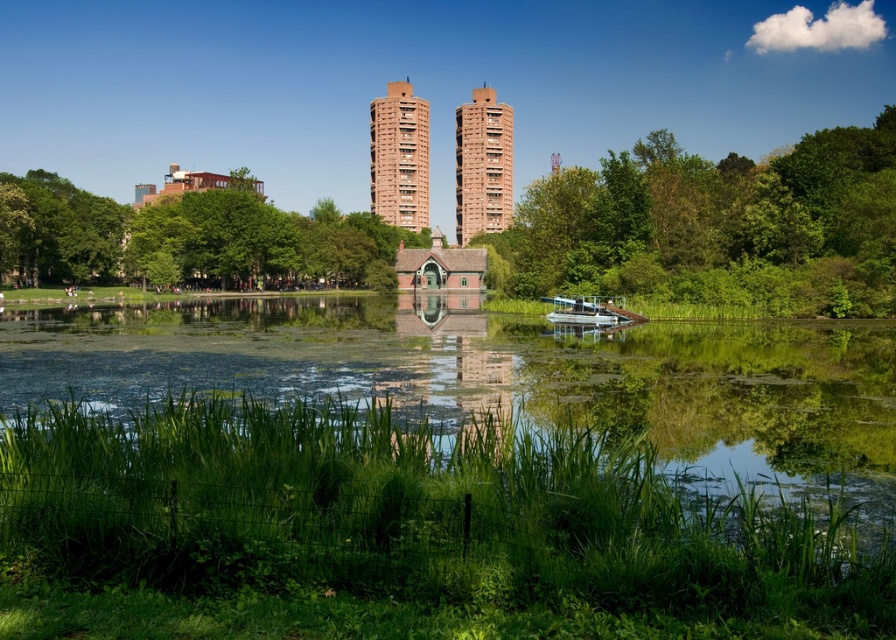
You are standing at point (506,380) in the park. What do you see around you?

You are standing at point (506,380) where the green grassy river at center is located.

You are planning to cross the green grassy river at center using the metallic silver pontoon boat at center. Considering their sizes, will the boat fit comfortably on the river without touching the banks?

The green grassy river at center is wider than the metallic silver pontoon boat at center, so the boat will fit comfortably on the river without touching the banks.

You are standing at the point with coordinates point (384, 108) and want to walk towards the point (617, 428). Which direction should you move?

You should move forward because point (617, 428) is closer to the viewer than point (384, 108), so it is in front of you.